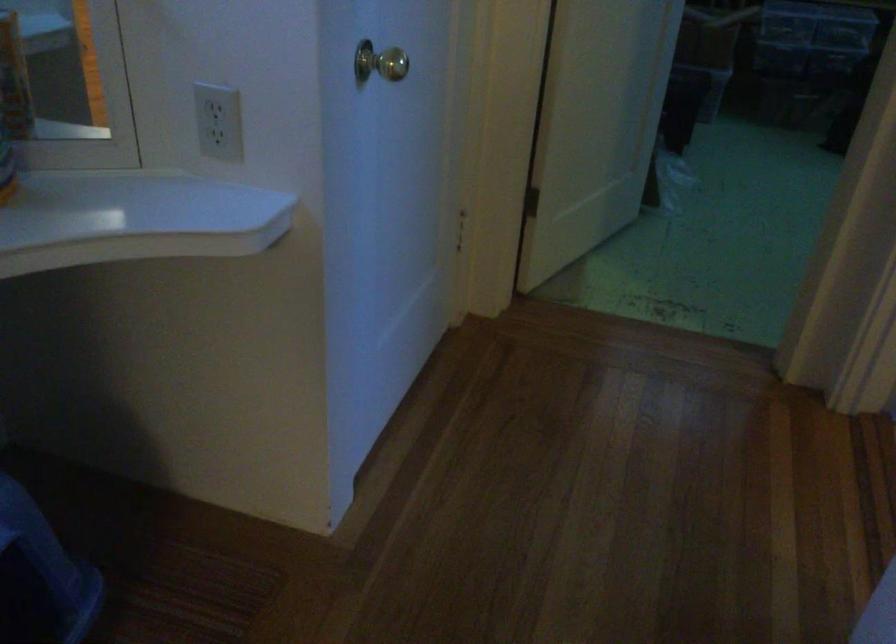
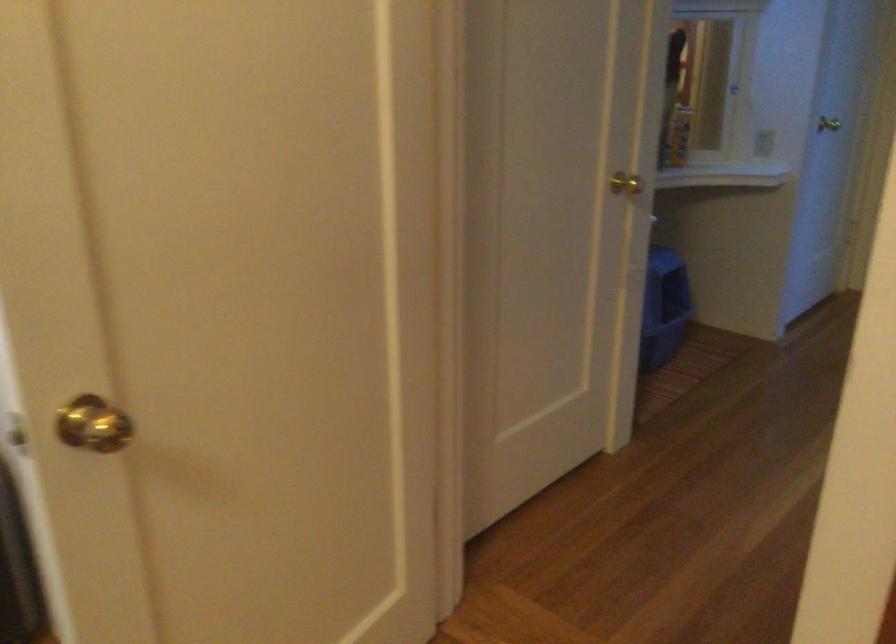
Where in the second image is the point corresponding to (x=89, y=521) from the first image?

(664, 308)